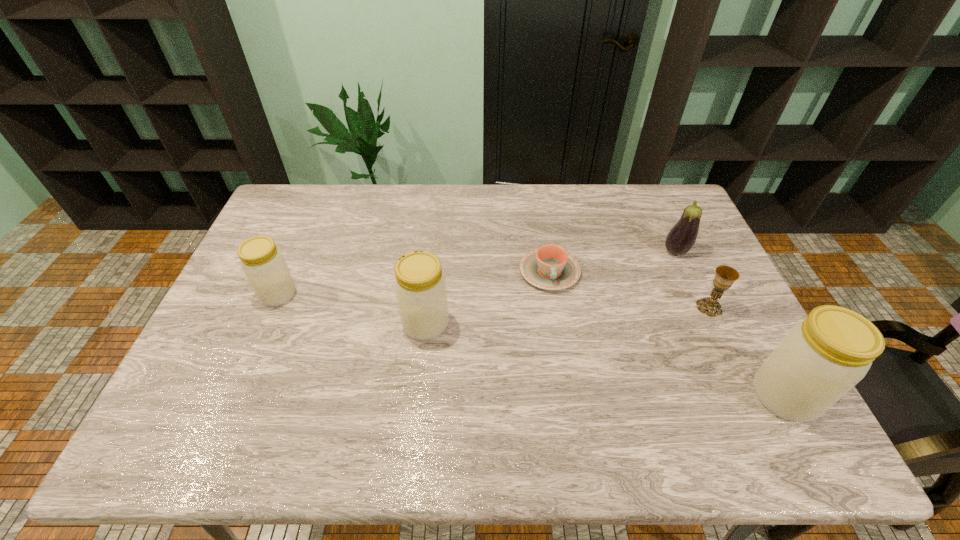
The height and width of the screenshot is (540, 960). I want to click on jar object that ranks as the second closest to the second shortest jar, so click(x=820, y=359).

Find the location of `free location that satisfies the following two spatial constraints: 1. on the handle side of the shortest object; 2. on the left side of the fifth tallest object`. free location that satisfies the following two spatial constraints: 1. on the handle side of the shortest object; 2. on the left side of the fifth tallest object is located at coordinates (555, 307).

At what (x,y) coordinates should I click in order to perform the action: click on free point that satisfies the following two spatial constraints: 1. on the handle side of the fourth object from right to left; 2. on the right side of the second shortest object. Please return your answer as a coordinate pair (x, y). The image size is (960, 540). Looking at the image, I should click on (555, 307).

This screenshot has width=960, height=540. What are the coordinates of `vacant space that satisfies the following two spatial constraints: 1. on the handle side of the fourth object from right to left; 2. on the left side of the chalice` in the screenshot? It's located at (555, 307).